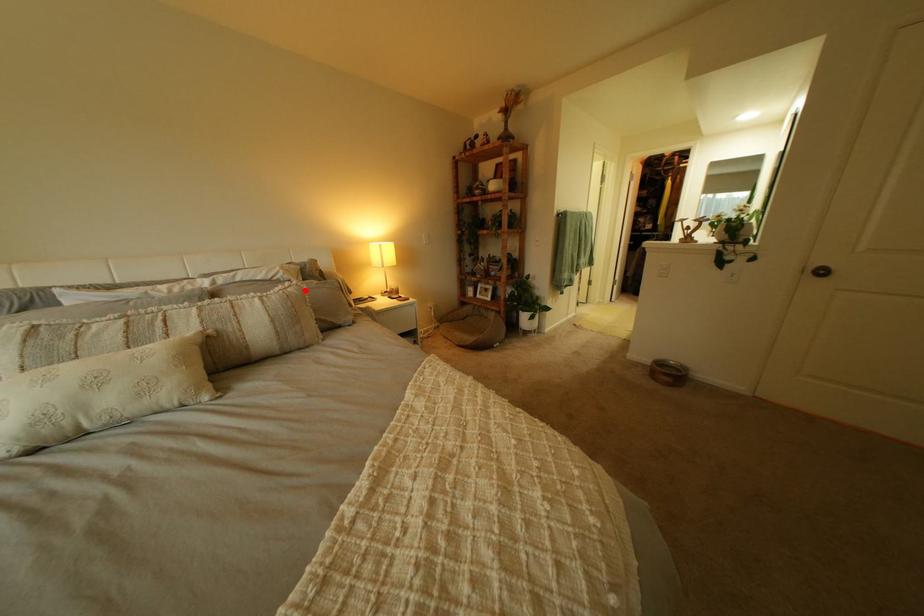
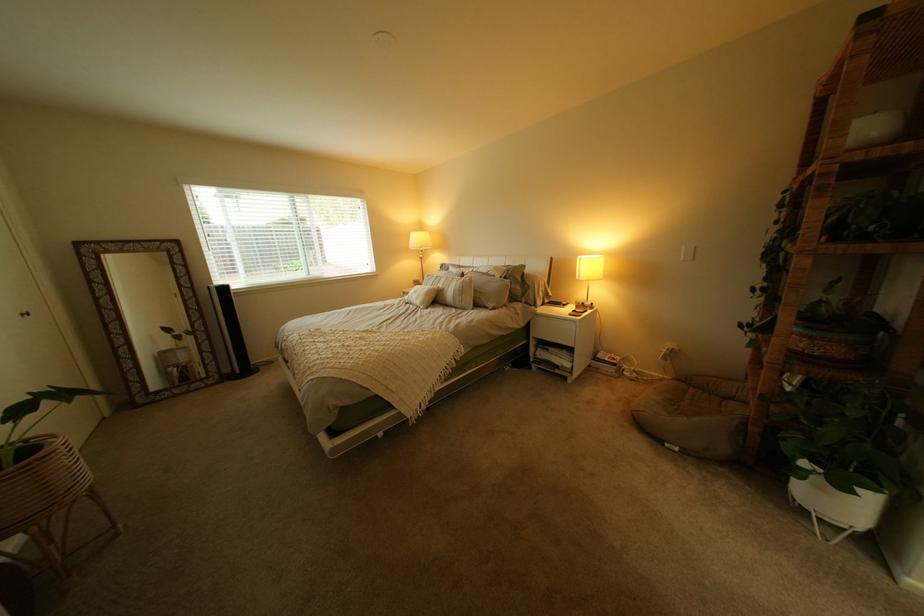
In the second image, find the point that corresponds to the highlighted location in the first image.

(482, 280)